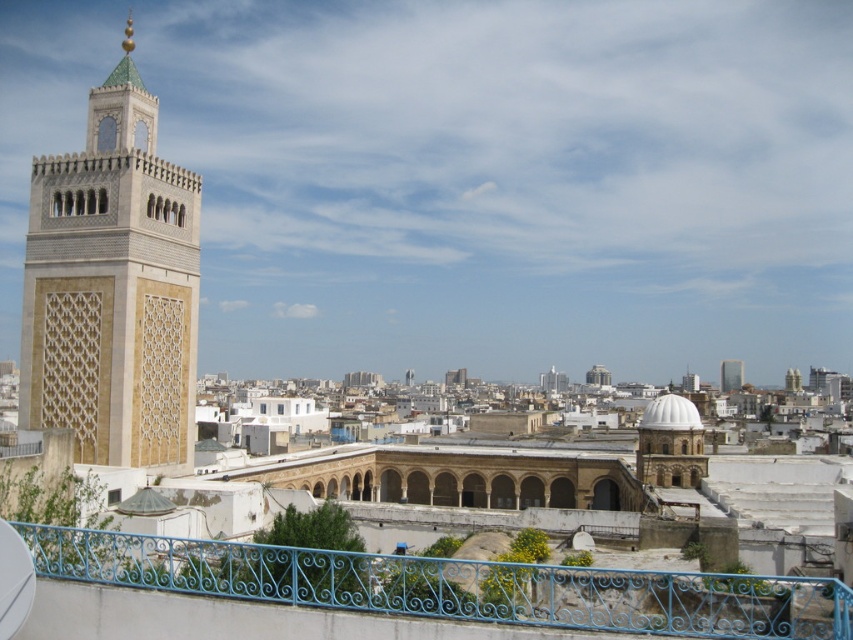
You are standing at the viewpoint of the image and want to walk towards the point with coordinates point (141, 410). Will you pass by the point point (724, 381) before reaching your destination?

No, because point (141, 410) is in front of point (724, 381), so you will reach point (141, 410) before passing point (724, 381).

You are standing at the center of the city square and want to reach the blue wrought iron railing at lower center. Which direction should you move in to get there?

Since the blue wrought iron railing at lower center is located at point (451, 586), you should move towards the lower center direction to reach it.